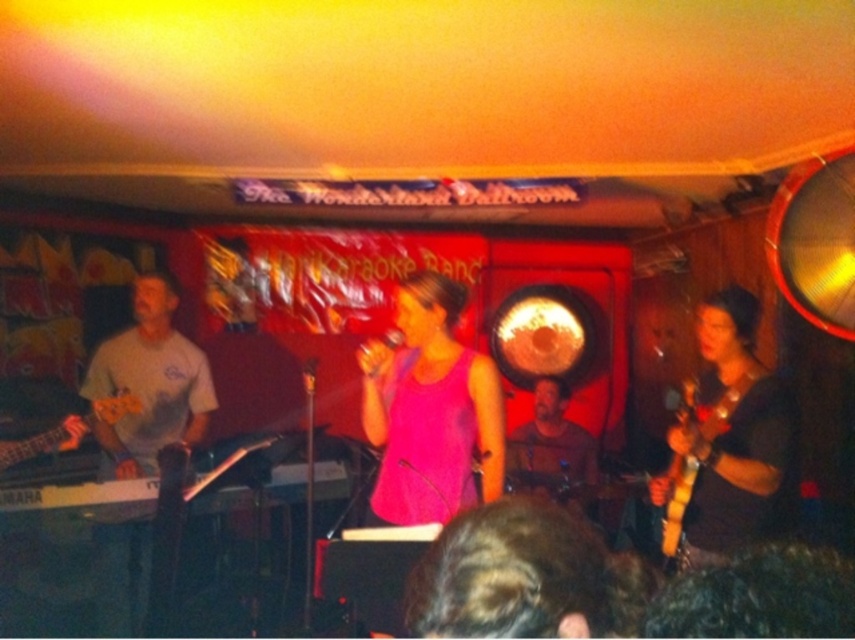
Is point (680, 445) positioned in front of point (101, 570)?

Yes, it is.

Does black matte guitar at right appear on the left side of white matte shirt at left?

No, black matte guitar at right is not to the left of white matte shirt at left.

You are a GUI agent. You are given a task and a screenshot of the screen. Output one action in this format:
    pyautogui.click(x=<x>, y=<y>)
    Task: Click on the black matte guitar at right
    
    Given the screenshot: What is the action you would take?
    pyautogui.click(x=724, y=442)

Which is in front, point (441, 321) or point (728, 552)?

Point (728, 552)

Based on the photo, can you confirm if pink matte tank top at center is wider than black matte guitar at right?

Correct, the width of pink matte tank top at center exceeds that of black matte guitar at right.

Describe the element at coordinates (429, 410) in the screenshot. I see `pink matte tank top at center` at that location.

Find the location of a particular element. The width and height of the screenshot is (855, 640). pink matte tank top at center is located at coordinates tap(429, 410).

Can you confirm if matte brown guitar at center is thinner than orange glossy guitar at left?

Indeed, matte brown guitar at center has a lesser width compared to orange glossy guitar at left.

Who is taller, matte brown guitar at center or orange glossy guitar at left?

With more height is matte brown guitar at center.

Does point (573, 497) come farther from viewer compared to point (105, 406)?

Yes.

Where is `matte brown guitar at center`? matte brown guitar at center is located at coordinates (555, 442).